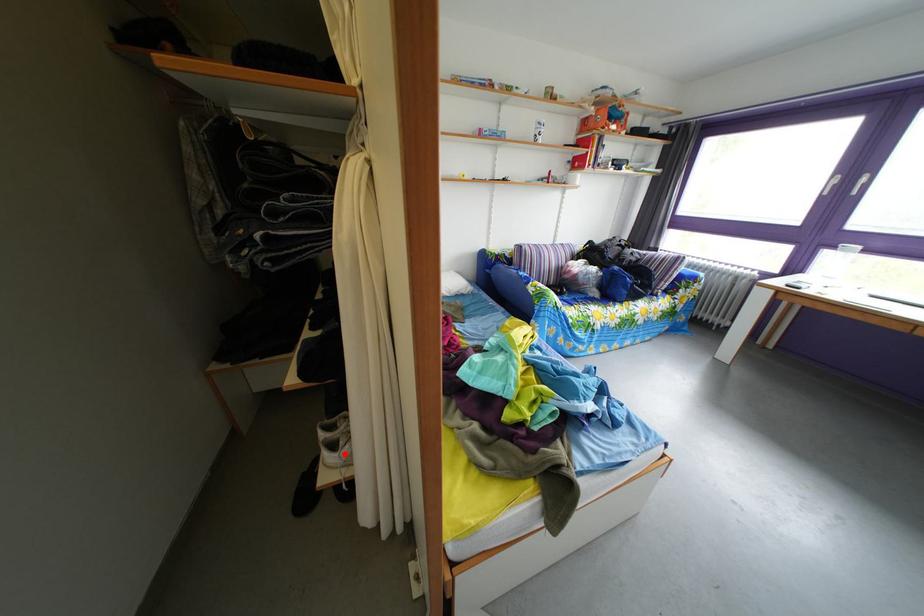
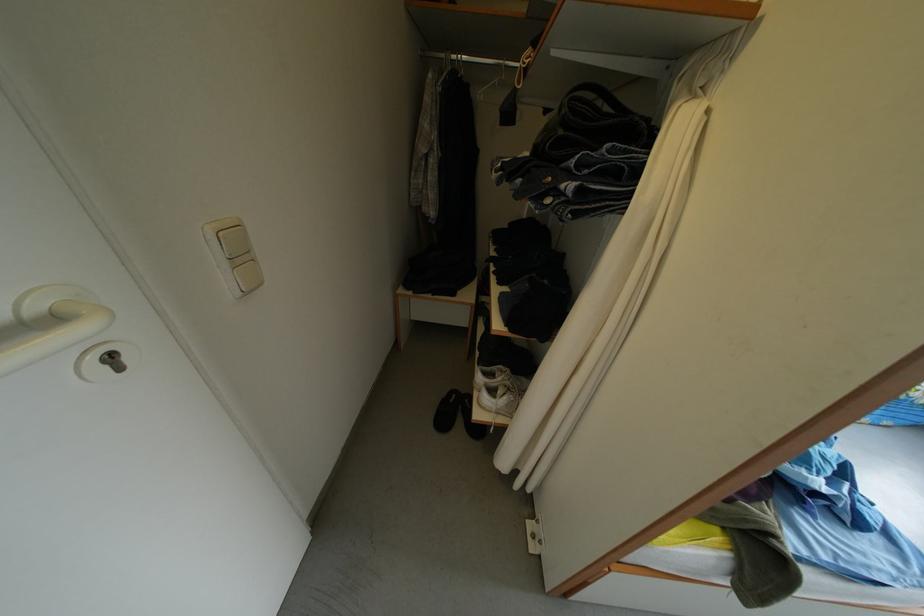
Question: I am providing you with two images of the same scene from different viewpoints. A red point is marked on the first image. Can you still see the location of the red point in image 2?

Choices:
 (A) Yes
 (B) No

Answer: (A)